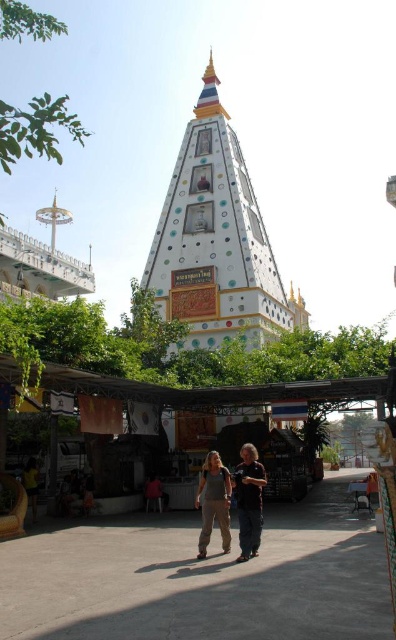
Consider the image. Who is more distant from viewer, (211, 52) or (255, 545)?

The point (211, 52) is behind.

Does white painted stupa at center come behind dark brown leather jacket at center?

Yes, it is.

This screenshot has height=640, width=396. I want to click on white painted stupa at center, so click(217, 241).

Between point (237, 476) and point (222, 529), which one is positioned behind?

Point (237, 476)

This screenshot has height=640, width=396. In order to click on dark brown leather jacket at center in this screenshot , I will do `click(249, 500)`.

Between point (253, 486) and point (213, 465), which one is positioned behind?

Positioned behind is point (213, 465).

Where is `dark brown leather jacket at center`? dark brown leather jacket at center is located at coordinates (249, 500).

Does dark gray fabric couple at center have a smaller size compared to dark brown leather jacket at center?

No.

Does dark gray fabric couple at center have a greater height compared to dark brown leather jacket at center?

Indeed, dark gray fabric couple at center has a greater height compared to dark brown leather jacket at center.

Identify the location of dark gray fabric couple at center. The image size is (396, 640). (230, 499).

Identify the location of dark gray fabric couple at center. (230, 499).